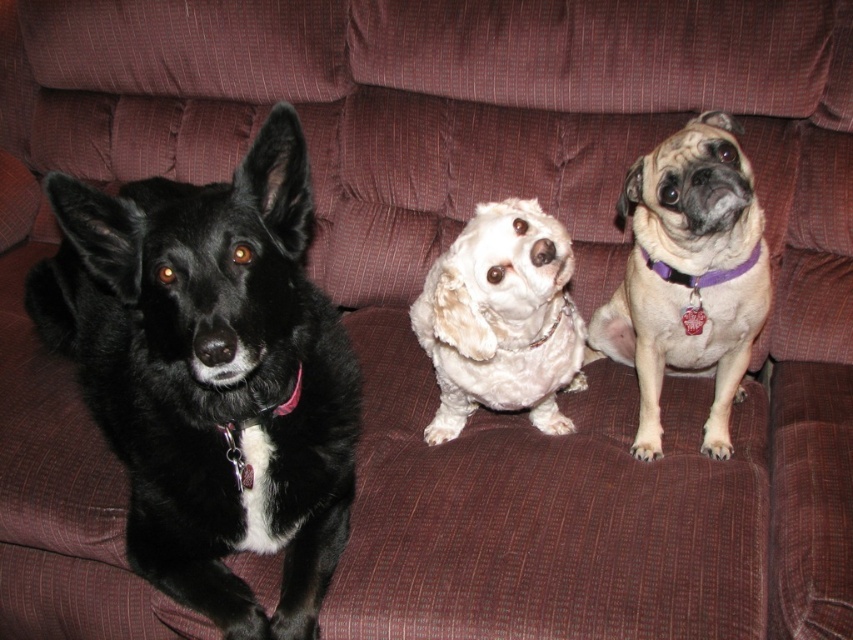
Looking at the maroon couch with its textured fabric, you see a black furry dog at left and a pale beige fur at center. Which dog is positioned closer to the right side of the couch?

The pale beige fur at center is positioned closer to the right side of the couch because it is to the right of the black furry dog at left.

You are a dog groomer who needs to bathe two dogs on the couch. The pale beige fur at center and the white fluffy dog at center are sitting close to each other. Can you fit both dogs into a grooming tub that is 12 inches wide?

The distance between the pale beige fur at center and the white fluffy dog at center is 8.92 inches, so yes, they can fit into the 12 inch wide tub since the space between them is less than the tub width.

You are a dog trainer assessing the spacing between the black furry dog at left and the white fluffy dog at center on the couch. Based on the image, can you confirm if there is enough space to comfortably fit a third dog between them?

The distance between the black furry dog at left and the white fluffy dog at center is 36.23 centimeters. Depending on the size of the third dog, this space may or may not be sufficient. For smaller breeds, it could be adequate, but larger dogs might require more room.